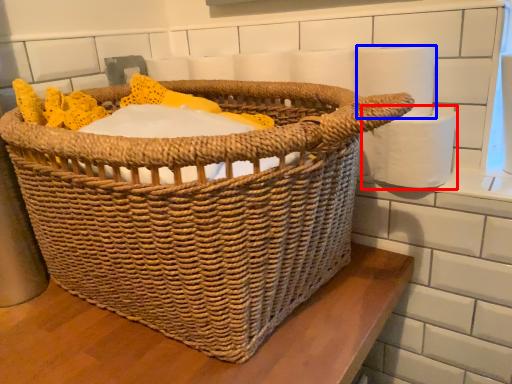
Question: Which of the following is the closest to the observer, toilet paper (highlighted by a red box) or toilet paper (highlighted by a blue box)?

Choices:
 (A) toilet paper
 (B) toilet paper

Answer: (B)